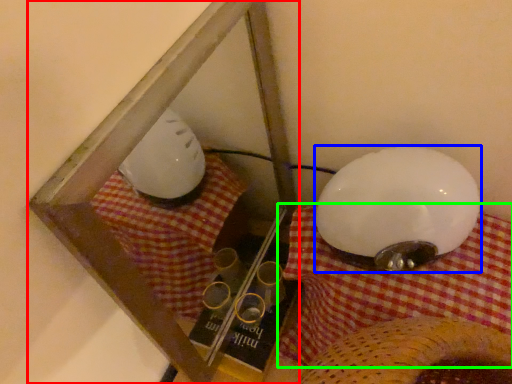
Question: Which is farther away from glass box (highlighted by a red box)? lamp (highlighted by a blue box) or blanket (highlighted by a green box)?

Choices:
 (A) lamp
 (B) blanket

Answer: (A)